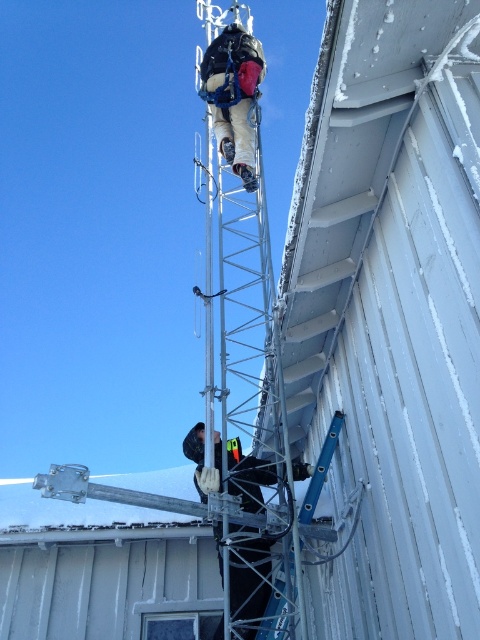
Question: Among these points, which one is nearest to the camera?

Choices:
 (A) (254, 180)
 (B) (244, 460)

Answer: (B)

Question: Which point is farther to the camera?

Choices:
 (A) (211, 42)
 (B) (230, 588)

Answer: (A)

Question: Does black fabric gloves at center have a smaller size compared to matte black harness at upper center?

Choices:
 (A) yes
 (B) no

Answer: (B)

Question: Is black fabric gloves at center above matte black harness at upper center?

Choices:
 (A) yes
 (B) no

Answer: (B)

Question: Can you confirm if black fabric gloves at center is positioned above matte black harness at upper center?

Choices:
 (A) no
 (B) yes

Answer: (A)

Question: Among these objects, which one is farthest from the camera?

Choices:
 (A) black fabric gloves at center
 (B) matte black harness at upper center

Answer: (B)